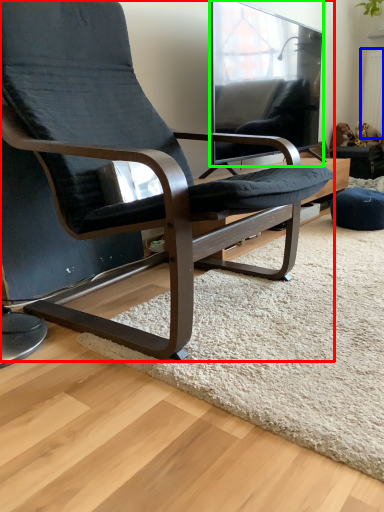
Question: Which is farther away from chair (highlighted by a red box)? radiator (highlighted by a blue box) or window (highlighted by a green box)?

Choices:
 (A) radiator
 (B) window

Answer: (A)